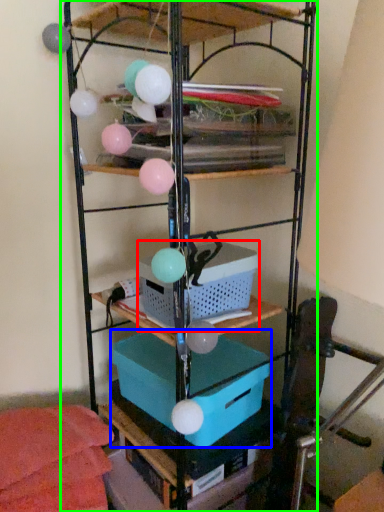
Question: Which object is the closest to the basket (highlighted by a red box)? Choose among these: box (highlighted by a blue box) or shelf (highlighted by a green box).

Choices:
 (A) box
 (B) shelf

Answer: (B)